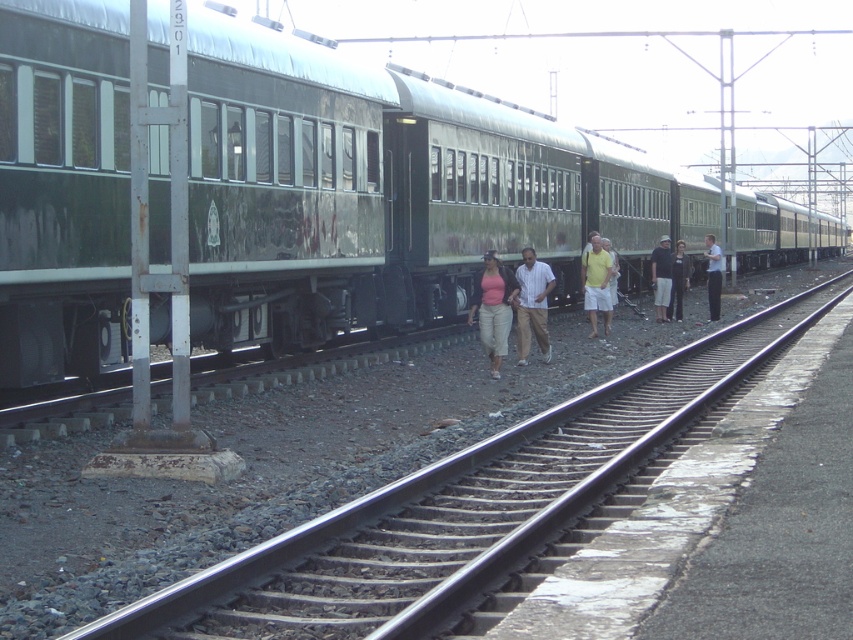
Question: Does black metal train track at lower left appear on the left side of yellow cotton shirt at center?

Choices:
 (A) no
 (B) yes

Answer: (A)

Question: Which point is closer to the camera?

Choices:
 (A) matte pink shirt at center
 (B) light blue shirt at right
 (C) dark brown leather jacket at center

Answer: (A)

Question: Which is farther from the light blue shirt at right?

Choices:
 (A) light brown cotton shirt at center
 (B) black metal train track at lower left
 (C) dark gray shorts at center
 (D) yellow cotton shirt at center

Answer: (A)

Question: Which object is the closest to the light brown cotton shirt at center?

Choices:
 (A) matte pink shirt at center
 (B) yellow cotton shirt at center

Answer: (A)

Question: Does green metallic train car at center appear under matte pink shirt at center?

Choices:
 (A) yes
 (B) no

Answer: (B)

Question: Does dark brown leather jacket at center have a smaller size compared to light blue shirt at right?

Choices:
 (A) no
 (B) yes

Answer: (B)